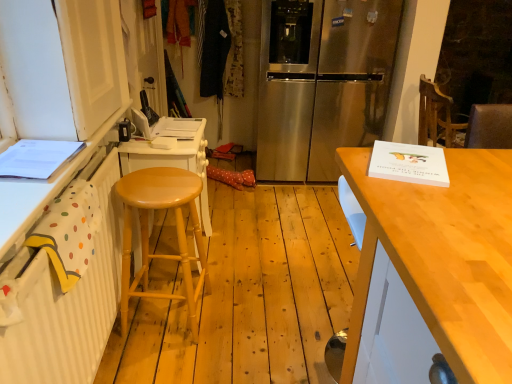
Find the location of a particular element. This screenshot has width=512, height=384. vacant area in front of light wood stool at left is located at coordinates [160, 364].